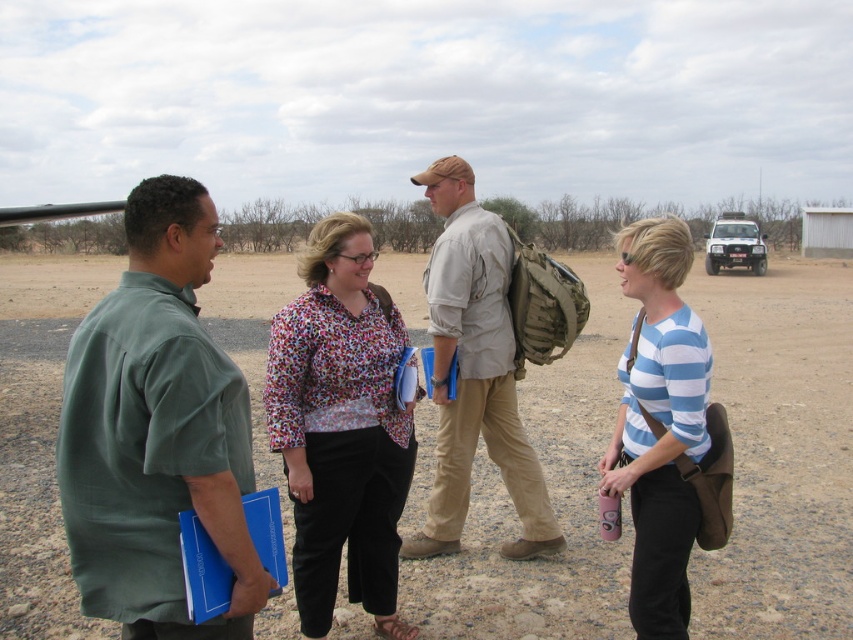
Question: Considering the real-world distances, which object is farthest from the dirt field at center?

Choices:
 (A) green matte shirt at left
 (B) floral fabric blouse at center
 (C) khaki fabric shirt at center

Answer: (C)

Question: Which of these objects is positioned farthest from the green matte shirt at left?

Choices:
 (A) floral fabric blouse at center
 (B) dirt field at center
 (C) blue striped shirt at center

Answer: (B)

Question: Which point is farther from the camera taking this photo?

Choices:
 (A) (552, 541)
 (B) (204, 372)
 (C) (445, 564)
 (D) (357, 396)

Answer: (A)

Question: Is dirt field at center positioned behind floral fabric blouse at center?

Choices:
 (A) yes
 (B) no

Answer: (A)

Question: Is the position of dirt field at center less distant than that of green matte shirt at left?

Choices:
 (A) yes
 (B) no

Answer: (B)

Question: Does floral fabric blouse at center appear on the left side of khaki fabric shirt at center?

Choices:
 (A) yes
 (B) no

Answer: (A)